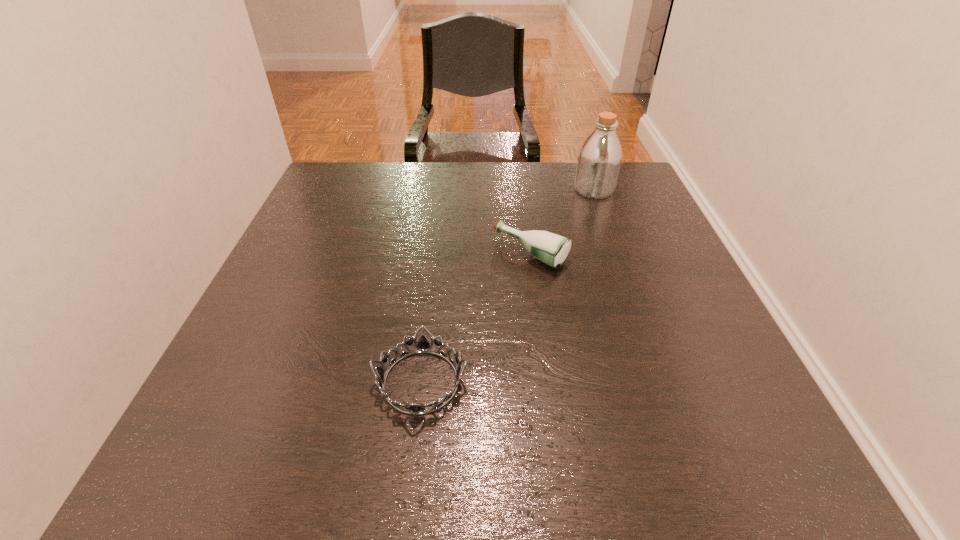
I want to click on the taller bottle, so click(x=599, y=159).

Image resolution: width=960 pixels, height=540 pixels. I want to click on the tallest object, so click(599, 159).

Locate an element on the screen. Image resolution: width=960 pixels, height=540 pixels. the second farthest object is located at coordinates (552, 249).

Where is `the shorter bottle`? the shorter bottle is located at coordinates (552, 249).

Find the location of a particular element. tiara is located at coordinates (423, 345).

This screenshot has width=960, height=540. I want to click on the leftmost object, so click(423, 345).

Find the location of a particular element. vacant area located on the left of the tallest object is located at coordinates (472, 190).

Where is `vacant space situated on the back of the shorter bottle`? The width and height of the screenshot is (960, 540). vacant space situated on the back of the shorter bottle is located at coordinates (522, 186).

At what (x,y) coordinates should I click in order to perform the action: click on object that is at the far edge. Please return your answer as a coordinate pair (x, y). The width and height of the screenshot is (960, 540). Looking at the image, I should click on (599, 159).

The height and width of the screenshot is (540, 960). What are the coordinates of `object positioned at the right edge` in the screenshot? It's located at (599, 159).